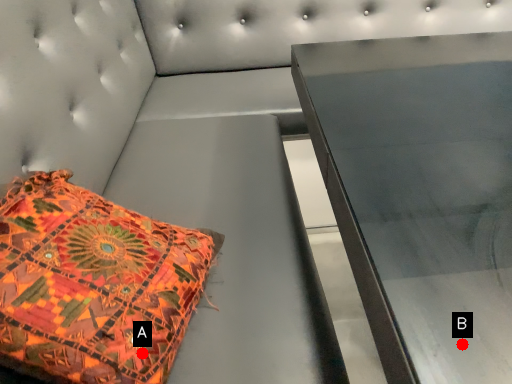
Question: Two points are circled on the image, labeled by A and B beside each circle. Which point is further to the camera?

Choices:
 (A) A is further
 (B) B is further

Answer: (A)